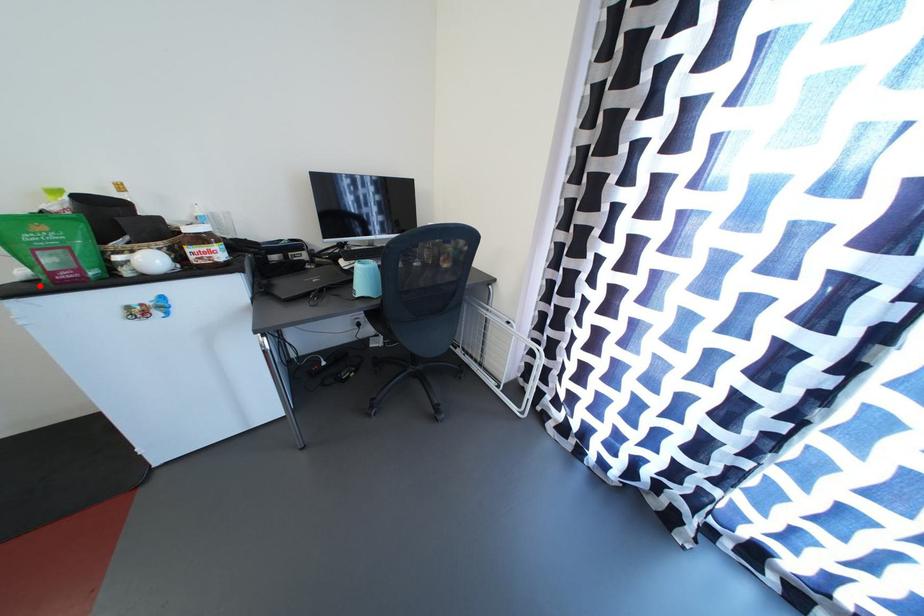
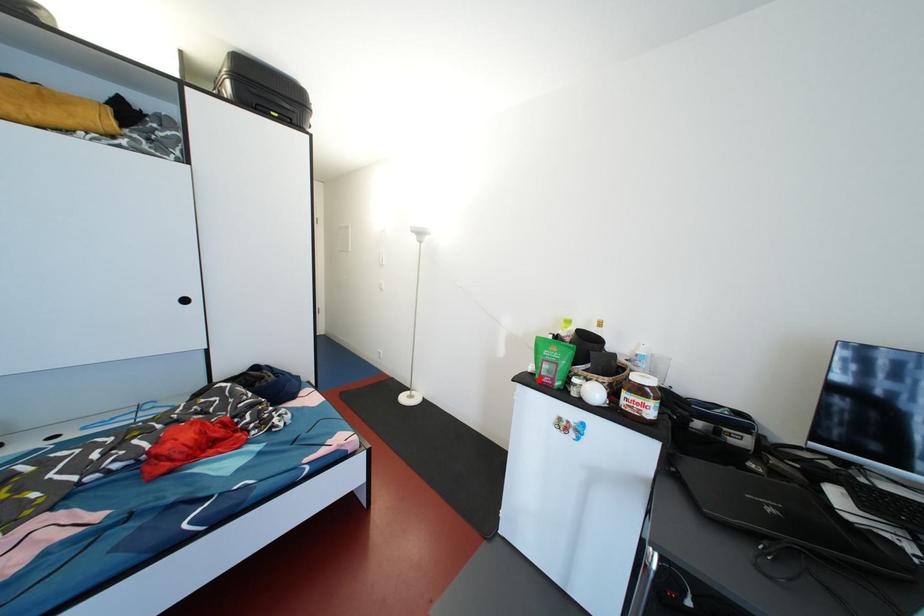
I am providing you with two images of the same scene from different viewpoints. A red point is marked on the first image and another point is marked on the second image. Does the point marked in image1 correspond to the same location as the one in image2?

Yes